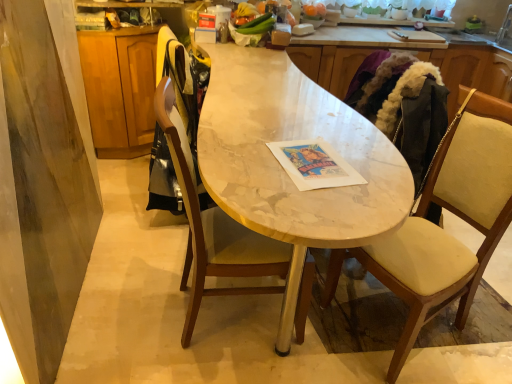
Where is `blank space situated above marble table at center (from a real-world perspective)`? blank space situated above marble table at center (from a real-world perspective) is located at coordinates (278, 95).